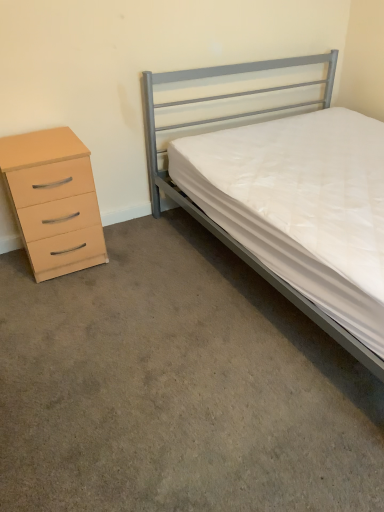
Question: Is metallic gray bed at right taller than carpet at lower left?

Choices:
 (A) yes
 (B) no

Answer: (A)

Question: From a real-world perspective, is metallic gray bed at right physically above carpet at lower left?

Choices:
 (A) yes
 (B) no

Answer: (A)

Question: Is metallic gray bed at right far from carpet at lower left?

Choices:
 (A) yes
 (B) no

Answer: (A)

Question: Does metallic gray bed at right have a larger size compared to carpet at lower left?

Choices:
 (A) no
 (B) yes

Answer: (B)

Question: Is metallic gray bed at right facing away from carpet at lower left?

Choices:
 (A) yes
 (B) no

Answer: (B)

Question: Considering the relative sizes of metallic gray bed at right and carpet at lower left in the image provided, is metallic gray bed at right smaller than carpet at lower left?

Choices:
 (A) no
 (B) yes

Answer: (A)

Question: Does beige matte chest of drawers at left come behind metallic gray bed at right?

Choices:
 (A) no
 (B) yes

Answer: (B)

Question: Considering the relative positions of beige matte chest of drawers at left and metallic gray bed at right in the image provided, is beige matte chest of drawers at left to the right of metallic gray bed at right from the viewer's perspective?

Choices:
 (A) no
 (B) yes

Answer: (A)

Question: Is beige matte chest of drawers at left not within metallic gray bed at right?

Choices:
 (A) no
 (B) yes

Answer: (B)

Question: From the image's perspective, is beige matte chest of drawers at left located above metallic gray bed at right?

Choices:
 (A) no
 (B) yes

Answer: (A)

Question: Does beige matte chest of drawers at left appear on the left side of metallic gray bed at right?

Choices:
 (A) yes
 (B) no

Answer: (A)

Question: Is beige matte chest of drawers at left bigger than metallic gray bed at right?

Choices:
 (A) no
 (B) yes

Answer: (A)

Question: Considering the relative positions of beige matte chest of drawers at left and carpet at lower left in the image provided, is beige matte chest of drawers at left in front of carpet at lower left?

Choices:
 (A) no
 (B) yes

Answer: (A)